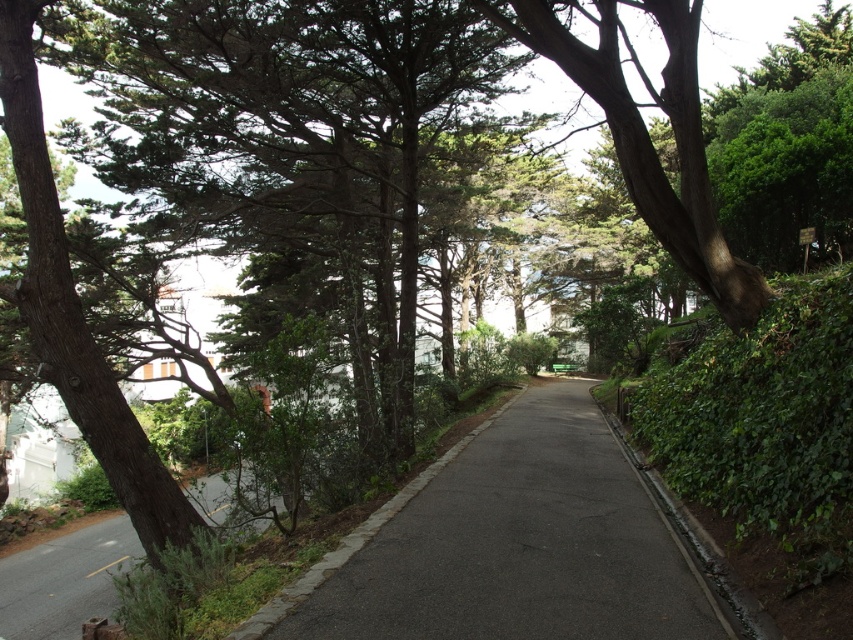
Question: Which of the following is the farthest from the observer?

Choices:
 (A) dark asphalt path at center
 (B) smooth asphalt road at center

Answer: (B)

Question: Based on their relative distances, which object is nearer to the dark asphalt path at center?

Choices:
 (A) smooth brown tree trunk at center
 (B) smooth asphalt road at center

Answer: (A)

Question: Which point is closer to the camera taking this photo?

Choices:
 (A) (691, 209)
 (B) (109, 564)

Answer: (A)

Question: Is dark asphalt path at center closer to the viewer compared to smooth asphalt road at center?

Choices:
 (A) no
 (B) yes

Answer: (B)

Question: Can you confirm if smooth brown tree trunk at center is bigger than smooth asphalt road at center?

Choices:
 (A) no
 (B) yes

Answer: (B)

Question: Can you confirm if smooth brown tree trunk at center is positioned to the left of smooth asphalt road at center?

Choices:
 (A) yes
 (B) no

Answer: (B)